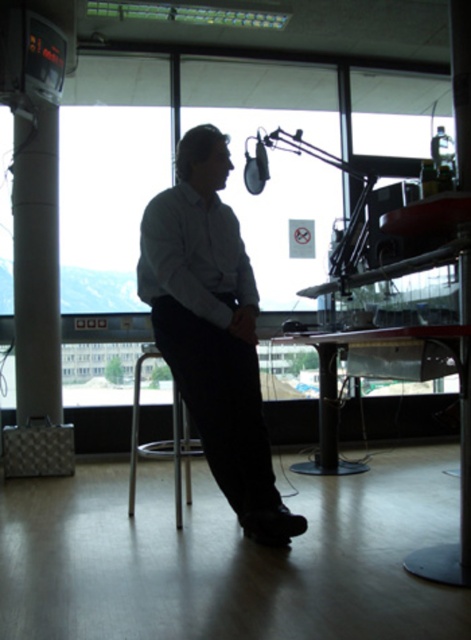
Question: Is light gray shirt at center in front of transparent glass table at center?

Choices:
 (A) yes
 (B) no

Answer: (B)

Question: Observing the image, what is the correct spatial positioning of white glossy pillar at left in reference to matte black pillar at center?

Choices:
 (A) below
 (B) above

Answer: (A)

Question: Which object appears farthest from the camera in this image?

Choices:
 (A) silver metallic stool at center
 (B) matte black pillar at center
 (C) white glossy pillar at left
 (D) white matte dress shirt at center

Answer: (C)

Question: Which object is the closest to the matte black pillar at center?

Choices:
 (A) white matte dress shirt at center
 (B) silver metallic stool at center
 (C) light gray shirt at center
 (D) transparent glass table at center

Answer: (A)

Question: Which of the following is the farthest from the observer?

Choices:
 (A) (227, 260)
 (B) (178, 509)
 (C) (19, 312)

Answer: (C)

Question: Is light gray shirt at center bigger than matte black pillar at center?

Choices:
 (A) no
 (B) yes

Answer: (B)